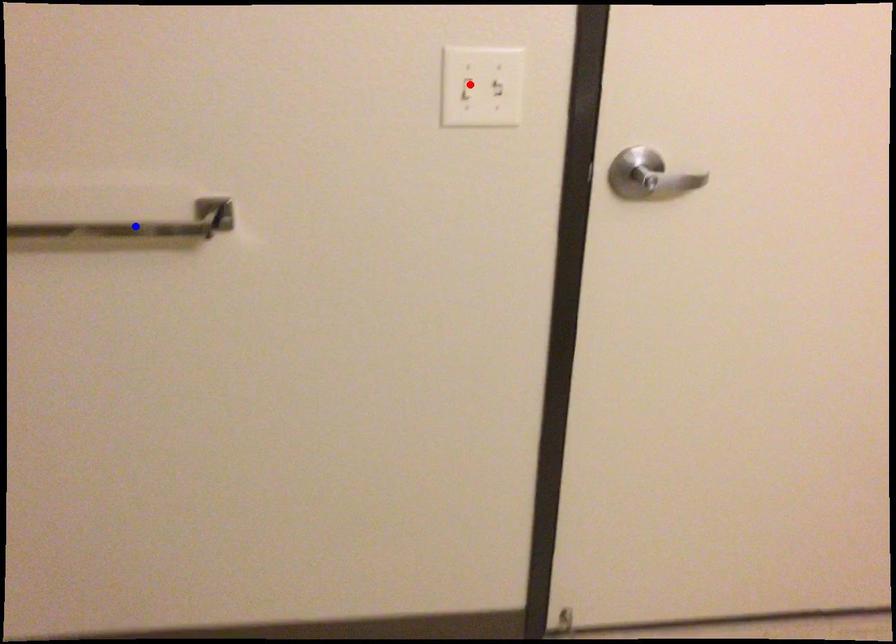
Question: Two points are marked on the image. Which point is closer to the camera?

Choices:
 (A) Blue point is closer.
 (B) Red point is closer.

Answer: (B)